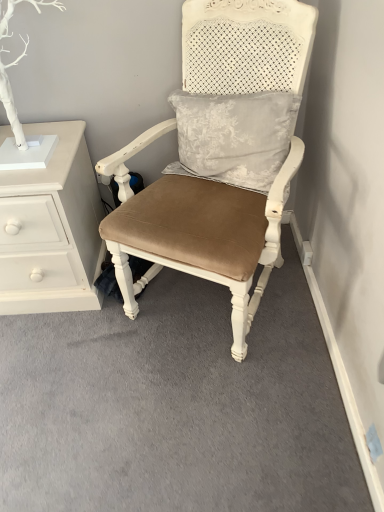
The width and height of the screenshot is (384, 512). Describe the element at coordinates (52, 229) in the screenshot. I see `white painted wood chest of drawers at left` at that location.

You are a GUI agent. You are given a task and a screenshot of the screen. Output one action in this format:
    pyautogui.click(x=<x>, y=<y>)
    Task: Click on the white painted wood chest of drawers at left
    The height and width of the screenshot is (512, 384).
    Given the screenshot: What is the action you would take?
    pyautogui.click(x=52, y=229)

Describe the element at coordinates (199, 232) in the screenshot. The image size is (384, 512). I see `suede-like tan cushion at center` at that location.

Measure the distance between suede-like tan cushion at center and camera.

1.13 meters.

Where is `suede-like tan cushion at center`? Image resolution: width=384 pixels, height=512 pixels. suede-like tan cushion at center is located at coordinates (199, 232).

Locate an element on the screen. The image size is (384, 512). white painted wood chest of drawers at left is located at coordinates (52, 229).

Consider the image. Can you confirm if suede-like tan cushion at center is positioned to the right of white painted wood chest of drawers at left?

Indeed, suede-like tan cushion at center is positioned on the right side of white painted wood chest of drawers at left.

Looking at this image, is suede-like tan cushion at center positioned in front of white painted wood chest of drawers at left?

Yes.

Does point (157, 259) lie in front of point (11, 133)?

Yes, it is in front of point (11, 133).

From the image's perspective, between suede-like tan cushion at center and white painted wood chest of drawers at left, who is located below?

white painted wood chest of drawers at left is shown below in the image.

From a real-world perspective, is suede-like tan cushion at center located higher than white painted wood chest of drawers at left?

Yes, from a real-world perspective, suede-like tan cushion at center is over white painted wood chest of drawers at left

In terms of width, does suede-like tan cushion at center look wider or thinner when compared to white painted wood chest of drawers at left?

suede-like tan cushion at center is wider than white painted wood chest of drawers at left.

Can you confirm if suede-like tan cushion at center is shorter than white painted wood chest of drawers at left?

No, suede-like tan cushion at center is not shorter than white painted wood chest of drawers at left.

Between suede-like tan cushion at center and white painted wood chest of drawers at left, which one has smaller size?

Smaller between the two is white painted wood chest of drawers at left.

Is suede-like tan cushion at center completely or partially outside of white painted wood chest of drawers at left?

Absolutely, suede-like tan cushion at center is external to white painted wood chest of drawers at left.

Based on the photo, is suede-like tan cushion at center beside white painted wood chest of drawers at left?

No.

Is suede-like tan cushion at center facing away from white painted wood chest of drawers at left?

No, suede-like tan cushion at center is not facing the opposite direction of white painted wood chest of drawers at left.

How different are the orientations of suede-like tan cushion at center and white painted wood chest of drawers at left in degrees?

There is a 27.8-degree angle between the facing directions of suede-like tan cushion at center and white painted wood chest of drawers at left.

Where is `chair that is in front of the white painted wood chest of drawers at left`? This screenshot has height=512, width=384. chair that is in front of the white painted wood chest of drawers at left is located at coordinates click(x=199, y=232).

Considering the positions of objects white painted wood chest of drawers at left and suede-like tan cushion at center in the image provided, who is more to the right, white painted wood chest of drawers at left or suede-like tan cushion at center?

Positioned to the right is suede-like tan cushion at center.

Looking at this image, is white painted wood chest of drawers at left positioned behind suede-like tan cushion at center?

Yes, it is behind suede-like tan cushion at center.

Is point (81, 182) positioned in front of point (123, 267)?

No, it is behind (123, 267).

Looking at this image, from the image's perspective, which is above, white painted wood chest of drawers at left or suede-like tan cushion at center?

suede-like tan cushion at center.

From a real-world perspective, is white painted wood chest of drawers at left positioned under suede-like tan cushion at center based on gravity?

Correct, in the physical world, white painted wood chest of drawers at left is lower than suede-like tan cushion at center.

Can you confirm if white painted wood chest of drawers at left is wider than suede-like tan cushion at center?

No, white painted wood chest of drawers at left is not wider than suede-like tan cushion at center.

Consider the image. Considering the relative sizes of white painted wood chest of drawers at left and suede-like tan cushion at center in the image provided, is white painted wood chest of drawers at left shorter than suede-like tan cushion at center?

Correct, white painted wood chest of drawers at left is not as tall as suede-like tan cushion at center.

Can you confirm if white painted wood chest of drawers at left is smaller than suede-like tan cushion at center?

Yes, white painted wood chest of drawers at left is smaller than suede-like tan cushion at center.

Looking at this image, which is correct: white painted wood chest of drawers at left is inside suede-like tan cushion at center, or outside of it?

The correct answer is: outside.

Is white painted wood chest of drawers at left not close to suede-like tan cushion at center?

No, there isn't a large distance between white painted wood chest of drawers at left and suede-like tan cushion at center.

Is white painted wood chest of drawers at left facing away from suede-like tan cushion at center?

No.

Could you measure the distance between white painted wood chest of drawers at left and suede-like tan cushion at center?

They are 13.80 inches apart.

I want to click on chair located above the white painted wood chest of drawers at left (from the image's perspective), so point(199,232).

Find the location of a particular element. chest of drawers that is on the left side of suede-like tan cushion at center is located at coordinates (52, 229).

Locate an element on the screen. The width and height of the screenshot is (384, 512). the chest of drawers behind the suede-like tan cushion at center is located at coordinates (52, 229).